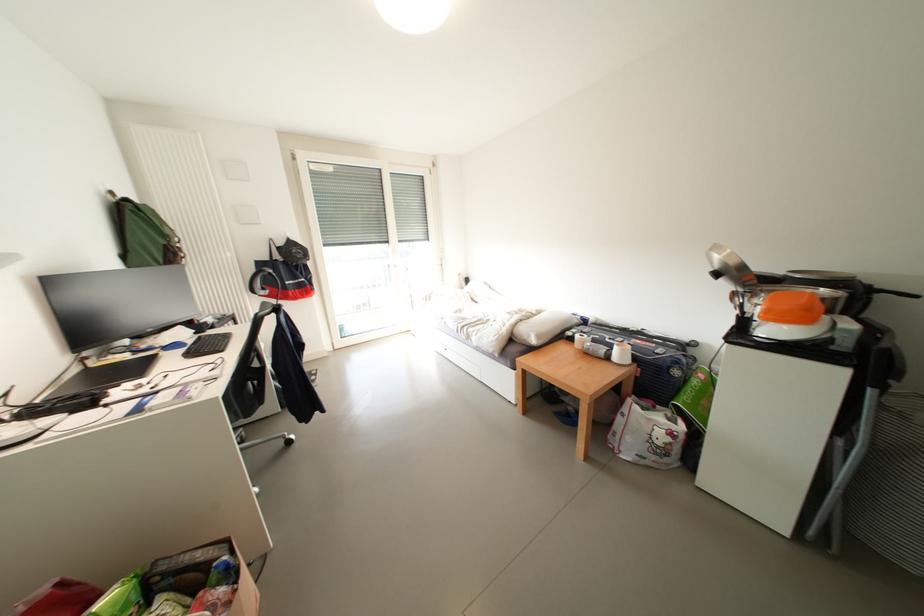
Locate an element on the screen. Image resolution: width=924 pixels, height=616 pixels. white pillow is located at coordinates (542, 326).